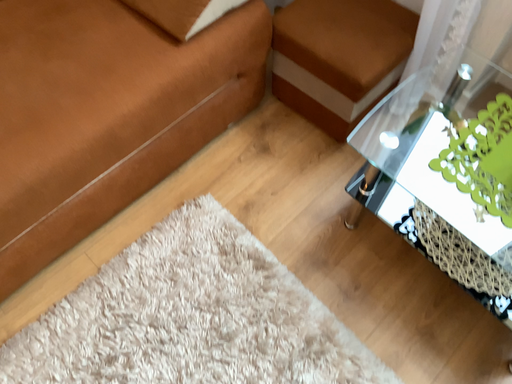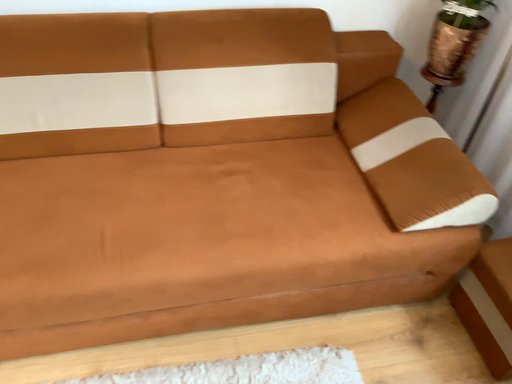
Question: Which way did the camera rotate in the video?

Choices:
 (A) rotated upward
 (B) rotated downward

Answer: (A)